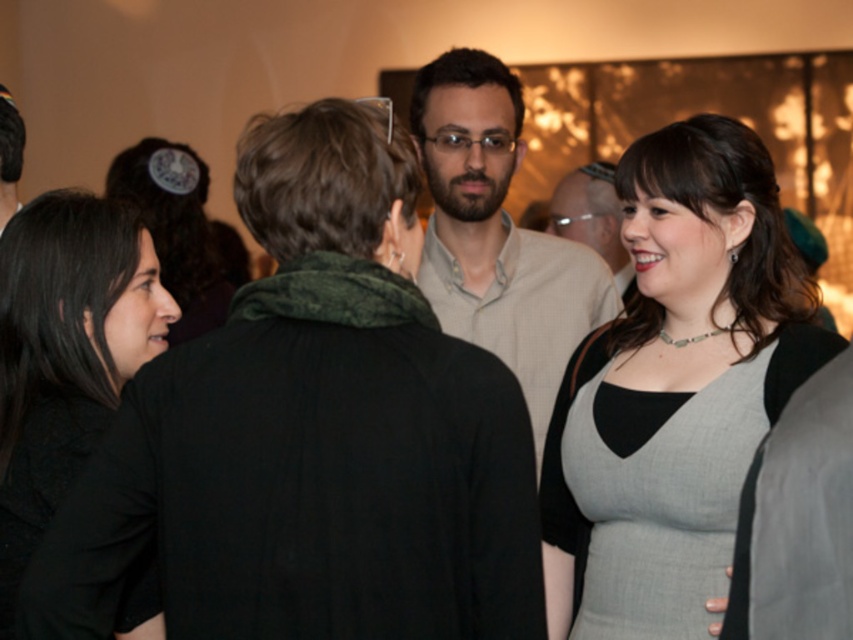
Question: Which object appears closest to the camera in this image?

Choices:
 (A) gray fabric dress at center
 (B) matte black shirt at center
 (C) light beige shirt at center
 (D) black matte dress at left

Answer: (D)

Question: Is matte black dress at lower right bigger than black matte dress at left?

Choices:
 (A) no
 (B) yes

Answer: (B)

Question: Among these objects, which one is nearest to the camera?

Choices:
 (A) black matte dress at left
 (B) light beige shirt at center
 (C) matte black shirt at center

Answer: (A)

Question: Which object is farther from the camera taking this photo?

Choices:
 (A) light beige shirt at center
 (B) matte black dress at lower right

Answer: (A)

Question: Is black matte dress at left wider than matte black shirt at center?

Choices:
 (A) yes
 (B) no

Answer: (B)

Question: Is light beige shirt at center thinner than matte black shirt at center?

Choices:
 (A) no
 (B) yes

Answer: (A)